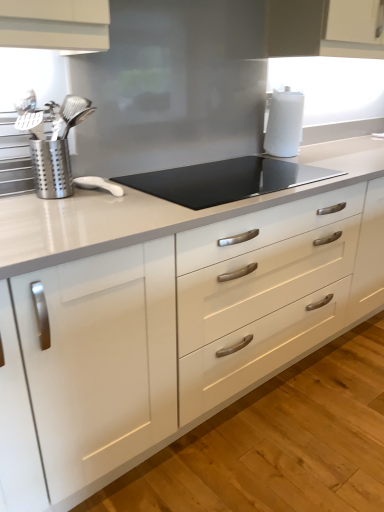
The image size is (384, 512). I want to click on white glossy countertop at center, so pyautogui.click(x=171, y=310).

Where is `silver metallic utensil holder at left`? Image resolution: width=384 pixels, height=512 pixels. silver metallic utensil holder at left is located at coordinates (52, 141).

What do you see at coordinates (225, 180) in the screenshot? This screenshot has width=384, height=512. I see `black glass cooktop at center` at bounding box center [225, 180].

Identify the location of white glossy countertop at center. (171, 310).

Is silver metallic utensil holder at left far from white matte paper towel at upper right?

silver metallic utensil holder at left is far away from white matte paper towel at upper right.

Could you tell me if silver metallic utensil holder at left is turned towards white matte paper towel at upper right?

No, silver metallic utensil holder at left does not turn towards white matte paper towel at upper right.

Does silver metallic utensil holder at left appear on the right side of white matte paper towel at upper right?

In fact, silver metallic utensil holder at left is to the left of white matte paper towel at upper right.

Which object is closer to the camera, silver metallic utensil holder at left or white matte paper towel at upper right?

silver metallic utensil holder at left is in front.

Considering the relative positions of black glass cooktop at center and white glossy countertop at center in the image provided, is black glass cooktop at center to the left of white glossy countertop at center from the viewer's perspective?

Yes.

Consider the image. From the image's perspective, which object appears higher, black glass cooktop at center or white glossy countertop at center?

From the image's view, black glass cooktop at center is above.

Is black glass cooktop at center directly adjacent to white glossy countertop at center?

black glass cooktop at center is not next to white glossy countertop at center, and they're not touching.

The image size is (384, 512). What are the coordinates of `countertop lying on the right of black glass cooktop at center` in the screenshot? It's located at (171, 310).

From the image's perspective, between white glossy countertop at center and silver metallic utensil holder at left, which one is located above?

silver metallic utensil holder at left, from the image's perspective.

Is white glossy countertop at center facing away from silver metallic utensil holder at left?

No, silver metallic utensil holder at left is not at the back of white glossy countertop at center.

Which object is positioned more to the right, white glossy countertop at center or silver metallic utensil holder at left?

Positioned to the right is white glossy countertop at center.

Where is `sink above the white glossy countertop at center (from a real-world perspective)`? Image resolution: width=384 pixels, height=512 pixels. sink above the white glossy countertop at center (from a real-world perspective) is located at coordinates (52, 141).

The image size is (384, 512). Identify the location of paper towel above the white glossy countertop at center (from the image's perspective). (284, 123).

Is white glossy countertop at center shorter than white matte paper towel at upper right?

No, white glossy countertop at center is not shorter than white matte paper towel at upper right.

Is white glossy countertop at center with white matte paper towel at upper right?

No.

Based on the photo, choose the correct answer: Is black glass cooktop at center inside white matte paper towel at upper right or outside it?

black glass cooktop at center exists outside the volume of white matte paper towel at upper right.

From a real-world perspective, is black glass cooktop at center positioned above or below white matte paper towel at upper right?

In terms of real-world spatial position, black glass cooktop at center is below white matte paper towel at upper right.

From the image's perspective, is black glass cooktop at center above or below white matte paper towel at upper right?

Clearly, from the image's perspective, black glass cooktop at center is below white matte paper towel at upper right.

Locate an element on the screen. countertop in front of the black glass cooktop at center is located at coordinates (171, 310).

What's the angular difference between white glossy countertop at center and black glass cooktop at center's facing directions?

They differ by 0.092 degrees in their facing directions.

Is white glossy countertop at center far from black glass cooktop at center?

They are positioned close to each other.

Does silver metallic utensil holder at left have a smaller size compared to white glossy countertop at center?

Correct, silver metallic utensil holder at left occupies less space than white glossy countertop at center.

Between silver metallic utensil holder at left and white glossy countertop at center, which one is positioned behind?

Positioned behind is silver metallic utensil holder at left.

Is silver metallic utensil holder at left taller or shorter than white glossy countertop at center?

Clearly, silver metallic utensil holder at left is shorter compared to white glossy countertop at center.

Consider the image. Considering the positions of objects silver metallic utensil holder at left and white glossy countertop at center in the image provided, who is more to the right, silver metallic utensil holder at left or white glossy countertop at center?

white glossy countertop at center.

You are a GUI agent. You are given a task and a screenshot of the screen. Output one action in this format:
    pyautogui.click(x=<x>, y=<y>)
    Task: Click on the paper towel behind the silver metallic utensil holder at left
    
    Given the screenshot: What is the action you would take?
    pyautogui.click(x=284, y=123)

Where is `countertop on the right of black glass cooktop at center`? The height and width of the screenshot is (512, 384). countertop on the right of black glass cooktop at center is located at coordinates (171, 310).

When comparing their distances from silver metallic utensil holder at left, does black glass cooktop at center or white matte paper towel at upper right seem closer?

black glass cooktop at center is closer to silver metallic utensil holder at left.

Estimate the real-world distances between objects in this image. Which object is closer to black glass cooktop at center, white matte paper towel at upper right or white glossy countertop at center?

The object closer to black glass cooktop at center is white matte paper towel at upper right.

Looking at the image, which one is located closer to white matte paper towel at upper right, silver metallic utensil holder at left or black glass cooktop at center?

black glass cooktop at center lies closer to white matte paper towel at upper right than the other object.

Which object lies nearer to the anchor point black glass cooktop at center, silver metallic utensil holder at left or white matte paper towel at upper right?

Among the two, white matte paper towel at upper right is located nearer to black glass cooktop at center.

Based on their spatial positions, is white glossy countertop at center or black glass cooktop at center closer to silver metallic utensil holder at left?

black glass cooktop at center.

Which object lies nearer to the anchor point white glossy countertop at center, silver metallic utensil holder at left or black glass cooktop at center?

Among the two, silver metallic utensil holder at left is located nearer to white glossy countertop at center.

Estimate the real-world distances between objects in this image. Which object is closer to white matte paper towel at upper right, black glass cooktop at center or silver metallic utensil holder at left?

Based on the image, black glass cooktop at center appears to be nearer to white matte paper towel at upper right.

Looking at the image, which one is located further to black glass cooktop at center, white matte paper towel at upper right or silver metallic utensil holder at left?

silver metallic utensil holder at left is positioned further to the anchor black glass cooktop at center.

You are a GUI agent. You are given a task and a screenshot of the screen. Output one action in this format:
    pyautogui.click(x=<x>, y=<y>)
    Task: Click on the gas stove between white glossy countertop at center and white matte paper towel at upper right in the front-back direction
    
    Given the screenshot: What is the action you would take?
    pyautogui.click(x=225, y=180)

At what (x,y) coordinates should I click in order to perform the action: click on gas stove situated between silver metallic utensil holder at left and white matte paper towel at upper right from left to right. Please return your answer as a coordinate pair (x, y). The image size is (384, 512). Looking at the image, I should click on (225, 180).

Where is `gas stove between silver metallic utensil holder at left and white glossy countertop at center in the horizontal direction`? gas stove between silver metallic utensil holder at left and white glossy countertop at center in the horizontal direction is located at coordinates tap(225, 180).

At what (x,y) coordinates should I click in order to perform the action: click on sink between white glossy countertop at center and white matte paper towel at upper right from front to back. Please return your answer as a coordinate pair (x, y). Looking at the image, I should click on (52, 141).